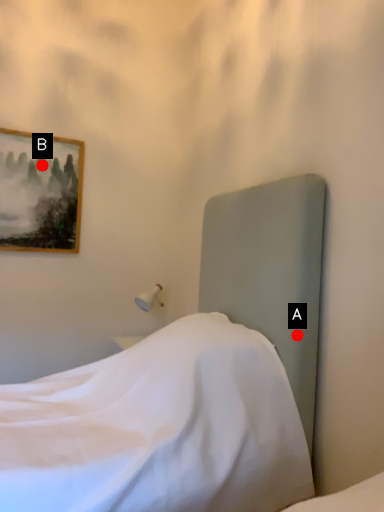
Question: Two points are circled on the image, labeled by A and B beside each circle. Which point is farther to the camera?

Choices:
 (A) A is further
 (B) B is further

Answer: (B)